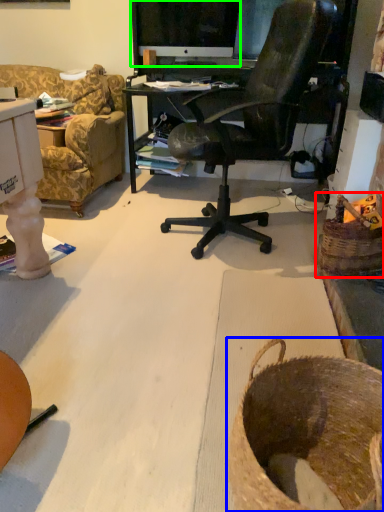
Question: Considering the real-world distances, which object is closest to basket (highlighted by a red box)? basket (highlighted by a blue box) or computer monitor (highlighted by a green box).

Choices:
 (A) basket
 (B) computer monitor

Answer: (A)